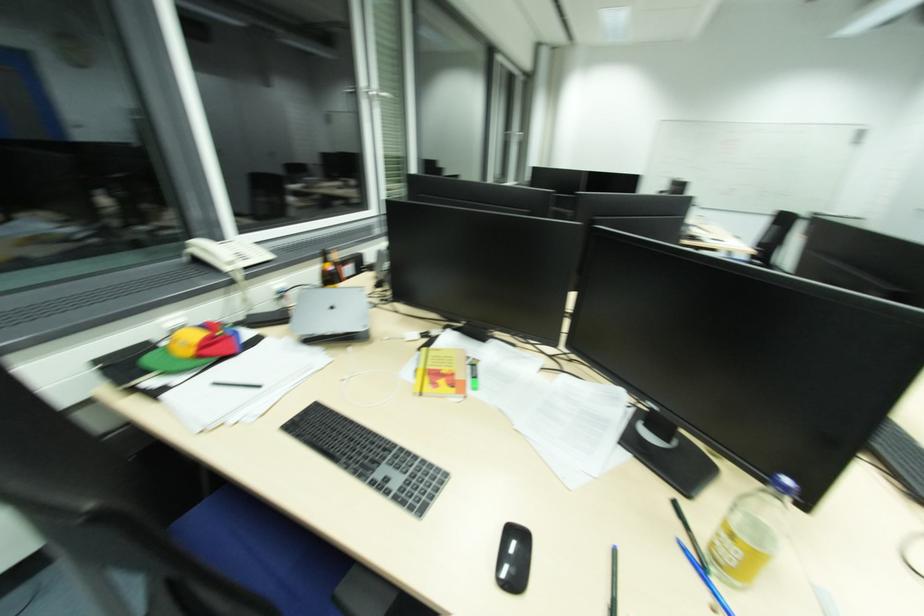
The height and width of the screenshot is (616, 924). What do you see at coordinates (211, 254) in the screenshot?
I see `the white telephone handset` at bounding box center [211, 254].